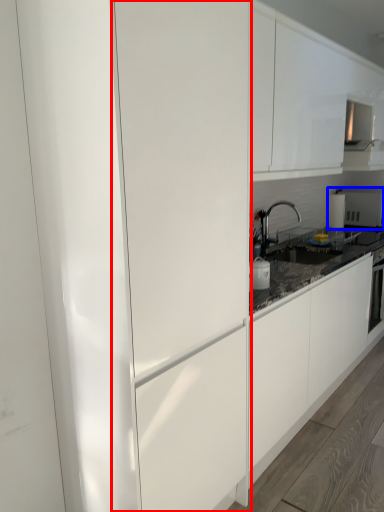
Question: Among these objects, which one is nearest to the camera, glass door (highlighted by a red box) or appliance (highlighted by a blue box)?

Choices:
 (A) glass door
 (B) appliance

Answer: (A)